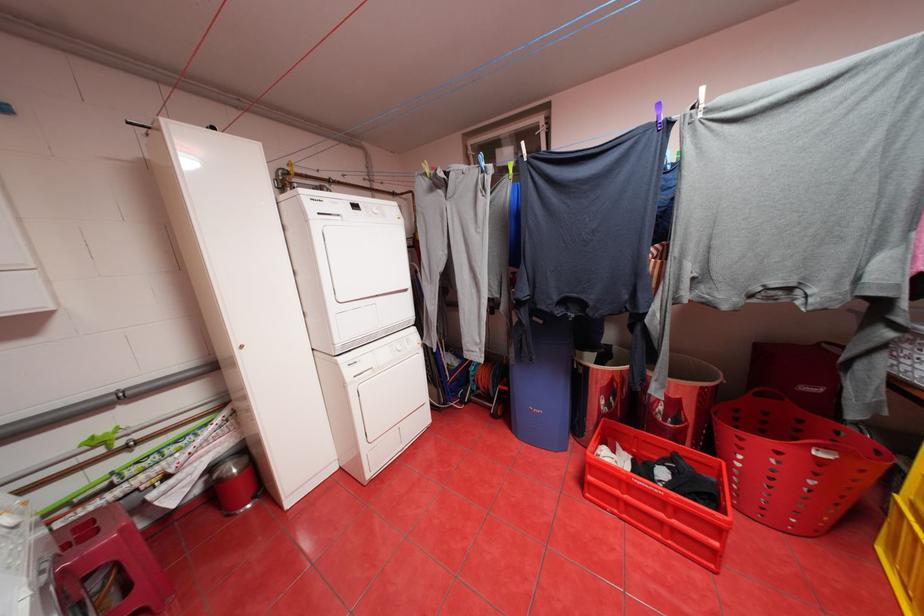
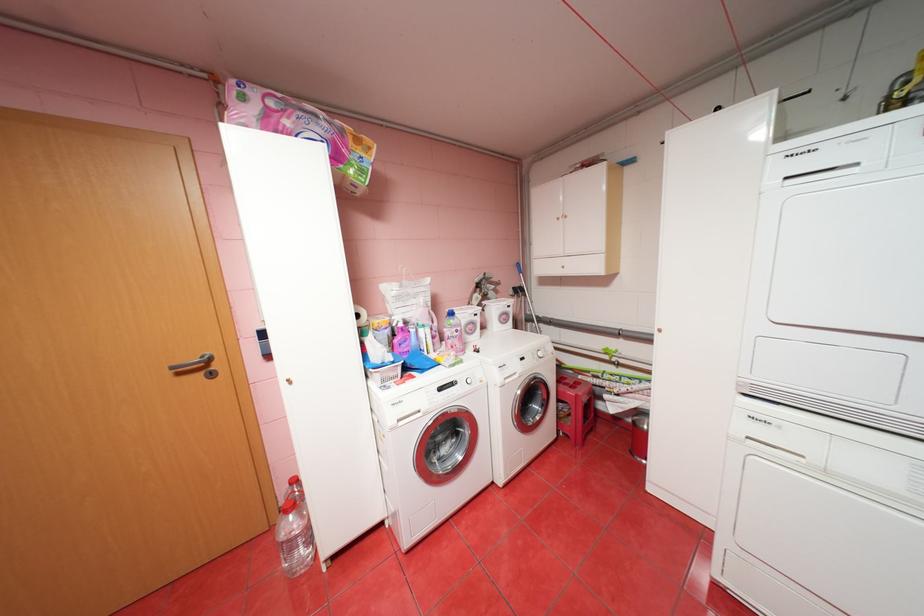
Consider the image. The images are taken continuously from a first-person perspective. In which direction is your viewpoint rotating?

The camera rotated toward left-down.